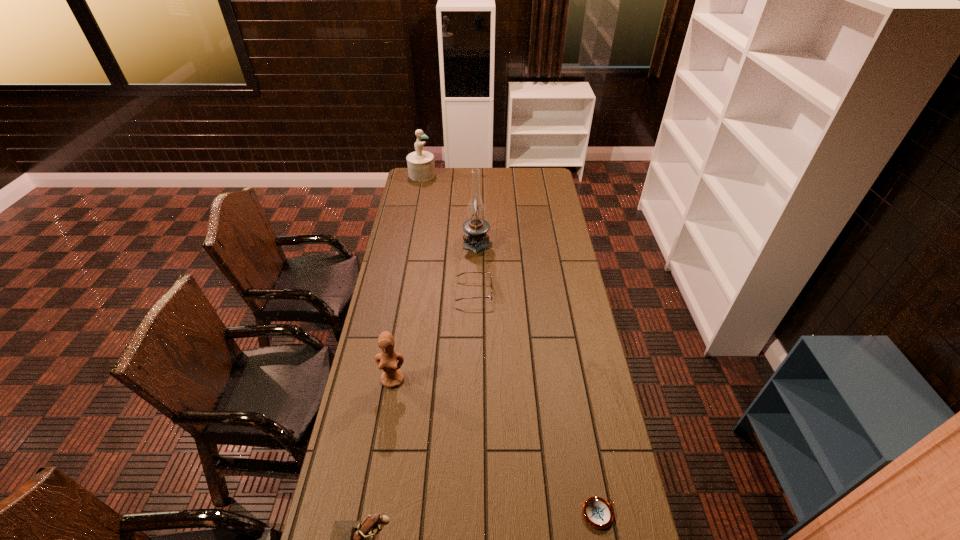
In order to click on oil lamp in this screenshot , I will do `click(475, 239)`.

This screenshot has height=540, width=960. Identify the location of the second farthest object. (475, 239).

Find the location of a particular element. the farthest figurine is located at coordinates tap(421, 167).

You are a GUI agent. You are given a task and a screenshot of the screen. Output one action in this format:
    pyautogui.click(x=<x>, y=<y>)
    Task: Click on the farthest object
    
    Given the screenshot: What is the action you would take?
    [x=421, y=167]

You are a GUI agent. You are given a task and a screenshot of the screen. Output one action in this format:
    pyautogui.click(x=<x>, y=<y>)
    Task: Click on the second farthest figurine
    
    Given the screenshot: What is the action you would take?
    pyautogui.click(x=392, y=376)

I want to click on the fourth nearest object, so click(x=491, y=286).

Locate an element on the screen. The height and width of the screenshot is (540, 960). spectacles is located at coordinates (491, 286).

You are a GUI agent. You are given a task and a screenshot of the screen. Output one action in this format:
    pyautogui.click(x=<x>, y=<y>)
    Task: Click on the rightmost object
    
    Given the screenshot: What is the action you would take?
    pyautogui.click(x=598, y=513)

Locate an element on the screen. The image size is (960, 540). the shortest object is located at coordinates (598, 513).

Identify the location of vacant region located 0.240m on the front of the second farthest object. tap(476, 289).